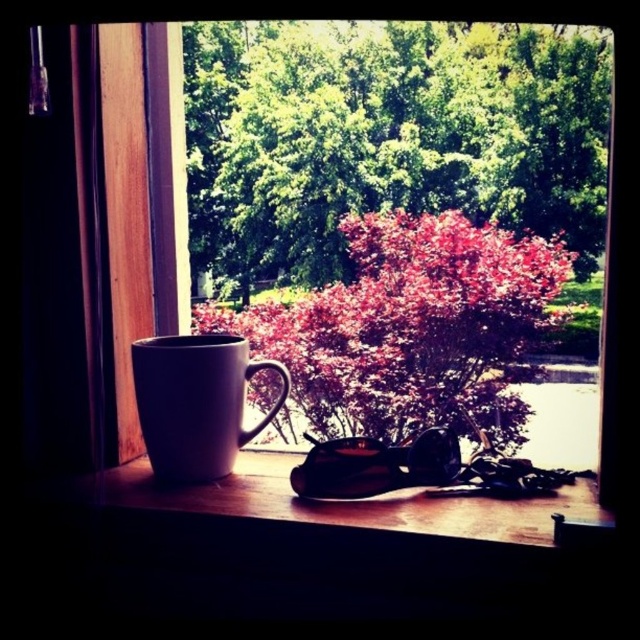
You are an interior designer planning to place a new decorative item between the matte red bush at center and the white matte mug at left. Based on their sizes, which object should the new item be placed closer to for balance?

The matte red bush at center is larger in size than the white matte mug at left, so the new item should be placed closer to the white matte mug at left to balance the composition.

You are standing in the room looking out the window. You need to place a small plant between the matte red bush at center and the white matte mug at left. Based on their positions, where should you position the new plant?

The matte red bush at center is located above the white matte mug at left, so you should place the new plant between them in the space below the matte red bush at center and above the white matte mug at left.

You are a gardener who wants to plant a new flower between the green leafy tree at upper center and the matte red bush at center. The flower requires at least 10 inches of space to grow properly. Based on the scene, will there be enough space for the flower?

The distance between the green leafy tree at upper center and the matte red bush at center is 8.19 inches, which is less than the required 10 inches. Therefore, there is not enough space for the flower to grow properly.